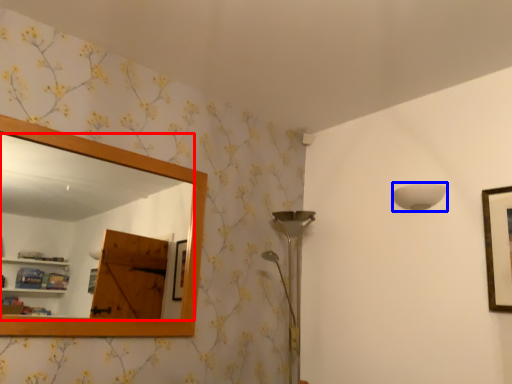
Question: Which point is further to the camera, mirror (highlighted by a red box) or lamp (highlighted by a blue box)?

Choices:
 (A) mirror
 (B) lamp

Answer: (B)